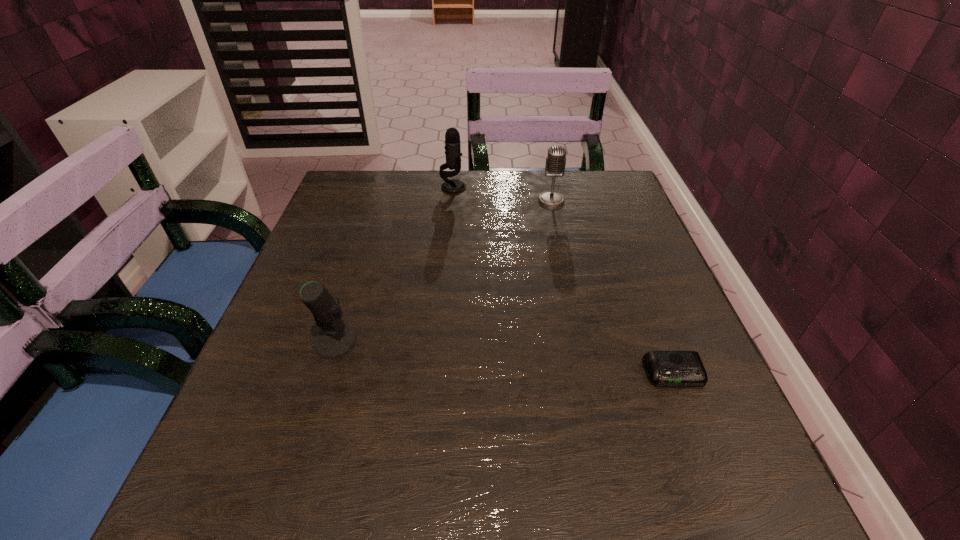
Identify the location of object situated at the left edge. Image resolution: width=960 pixels, height=540 pixels. click(x=333, y=341).

Where is `object that is at the right edge`? The height and width of the screenshot is (540, 960). object that is at the right edge is located at coordinates (664, 368).

This screenshot has width=960, height=540. In order to click on blank space at the far edge in this screenshot , I will do `click(392, 207)`.

The width and height of the screenshot is (960, 540). I want to click on vacant space at the left edge of the desktop, so click(329, 231).

In the image, there is a desktop. Where is `vacant region at the right edge`? This screenshot has height=540, width=960. vacant region at the right edge is located at coordinates (592, 241).

Where is `vacant space at the near left corner`? vacant space at the near left corner is located at coordinates (221, 474).

Find the location of `free space at the far right corner of the desktop`. free space at the far right corner of the desktop is located at coordinates (578, 178).

The height and width of the screenshot is (540, 960). In order to click on free area in between the third object from right to left and the third object from left to right in this screenshot , I will do `click(502, 194)`.

You are a GUI agent. You are given a task and a screenshot of the screen. Output one action in this format:
    pyautogui.click(x=<x>, y=<y>)
    Task: Click on the empty space between the rightmost object and the rightmost microphone
    
    Given the screenshot: What is the action you would take?
    pyautogui.click(x=612, y=287)

Where is `free space between the third object from left to right and the leftmost microphone`? The height and width of the screenshot is (540, 960). free space between the third object from left to right and the leftmost microphone is located at coordinates (444, 271).